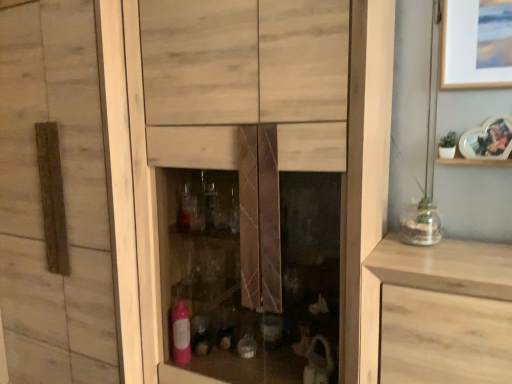
You are a GUI agent. You are given a task and a screenshot of the screen. Output one action in this format:
    pyautogui.click(x=<x>, y=<y>)
    Task: Click on the space that is in front of clear glass vase at right
    
    Given the screenshot: What is the action you would take?
    pyautogui.click(x=440, y=262)